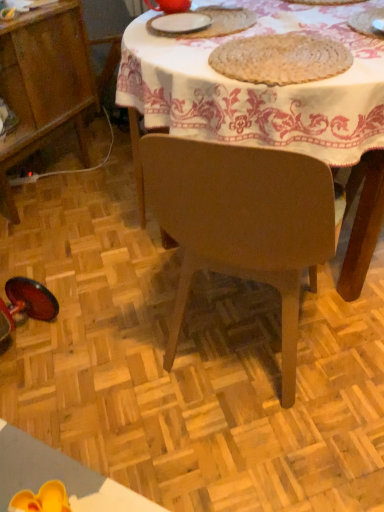
Find the location of a particular element. The image size is (384, 512). free space behind brown woven placemat at upper center is located at coordinates (257, 27).